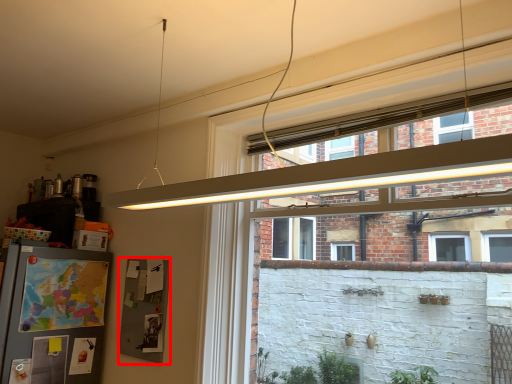
Question: In this image, where is bulletin board (annotated by the red box) located relative to window?

Choices:
 (A) right
 (B) left

Answer: (B)